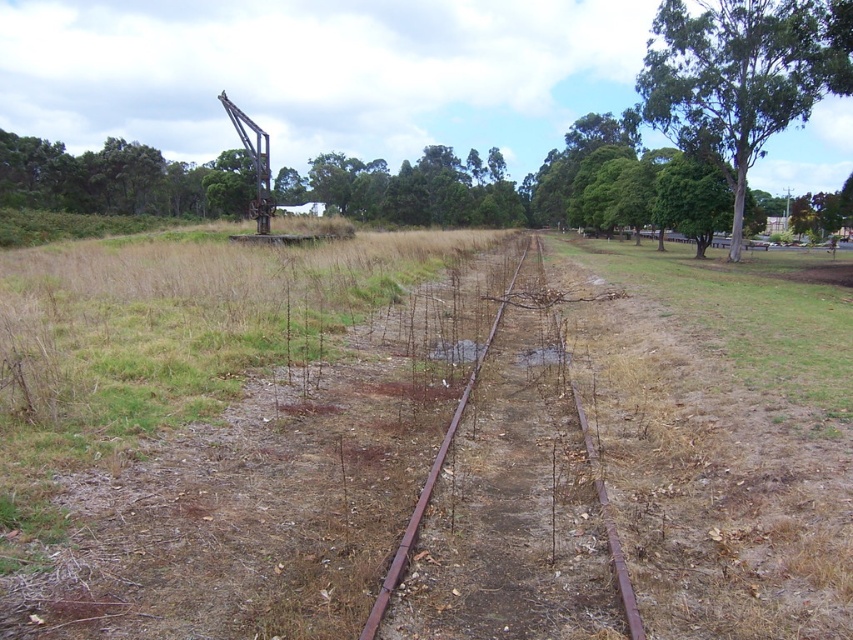
Question: Does rusty metal train track at center have a larger size compared to green leafy tree at upper right?

Choices:
 (A) no
 (B) yes

Answer: (A)

Question: Is rusty metal train track at center further to the viewer compared to green leafy tree at upper right?

Choices:
 (A) no
 (B) yes

Answer: (A)

Question: Among these points, which one is nearest to the camera?

Choices:
 (A) (657, 54)
 (B) (486, 394)

Answer: (B)

Question: Is rusty metal train track at center below green leafy tree at upper right?

Choices:
 (A) no
 (B) yes

Answer: (B)

Question: Which point is farther to the camera?

Choices:
 (A) (672, 48)
 (B) (511, 330)

Answer: (A)

Question: Which point is farther from the camera taking this photo?

Choices:
 (A) (689, 52)
 (B) (524, 298)

Answer: (A)